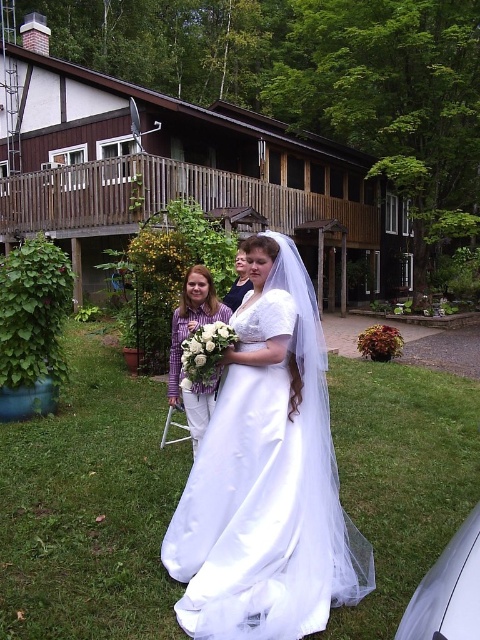
Question: Which object is farther from the camera taking this photo?

Choices:
 (A) white satin dress at center
 (B) purple striped shirt at center

Answer: (B)

Question: Does white satin dress at center have a lesser width compared to purple striped shirt at center?

Choices:
 (A) no
 (B) yes

Answer: (A)

Question: Is white satin dress at center smaller than purple striped shirt at center?

Choices:
 (A) no
 (B) yes

Answer: (A)

Question: Is white satin dress at center above purple striped shirt at center?

Choices:
 (A) yes
 (B) no

Answer: (B)